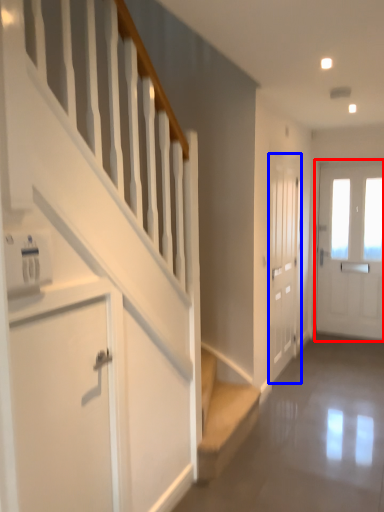
Question: Which object is closer to the camera taking this photo, door (highlighted by a red box) or door (highlighted by a blue box)?

Choices:
 (A) door
 (B) door

Answer: (B)